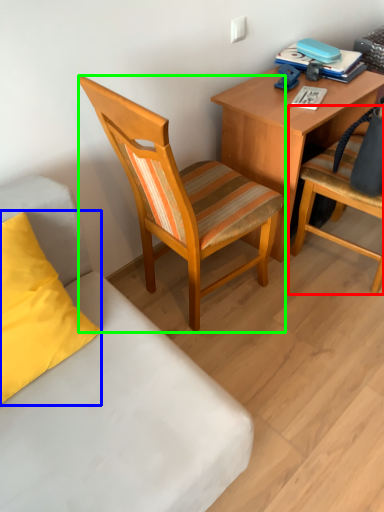
Question: Which object is positioned farthest from chair (highlighted by a red box)? Select from pillow (highlighted by a blue box) and chair (highlighted by a green box).

Choices:
 (A) pillow
 (B) chair

Answer: (A)